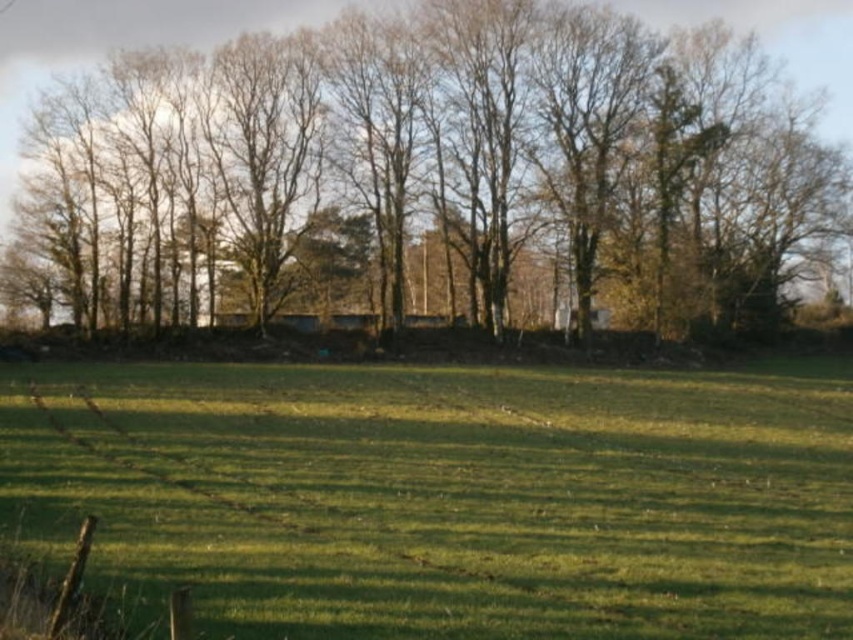
Question: Is green grass at center smaller than brown leafless trees at upper center?

Choices:
 (A) no
 (B) yes

Answer: (B)

Question: Which point is closer to the camera taking this photo?

Choices:
 (A) (22, 54)
 (B) (131, 496)

Answer: (B)

Question: Is green grass at center below brown leafless trees at upper center?

Choices:
 (A) no
 (B) yes

Answer: (B)

Question: Does green grass at center have a lesser width compared to brown leafless trees at upper center?

Choices:
 (A) yes
 (B) no

Answer: (A)